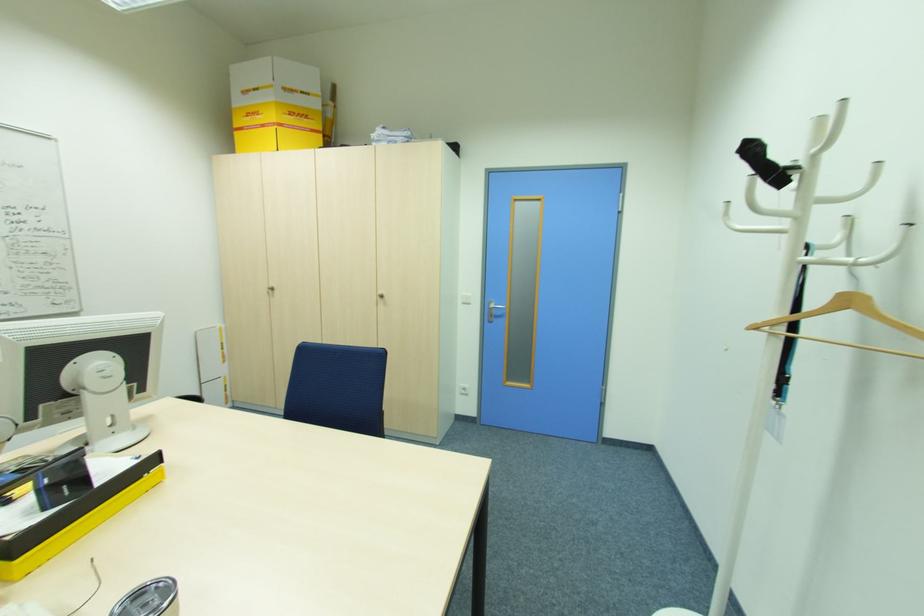
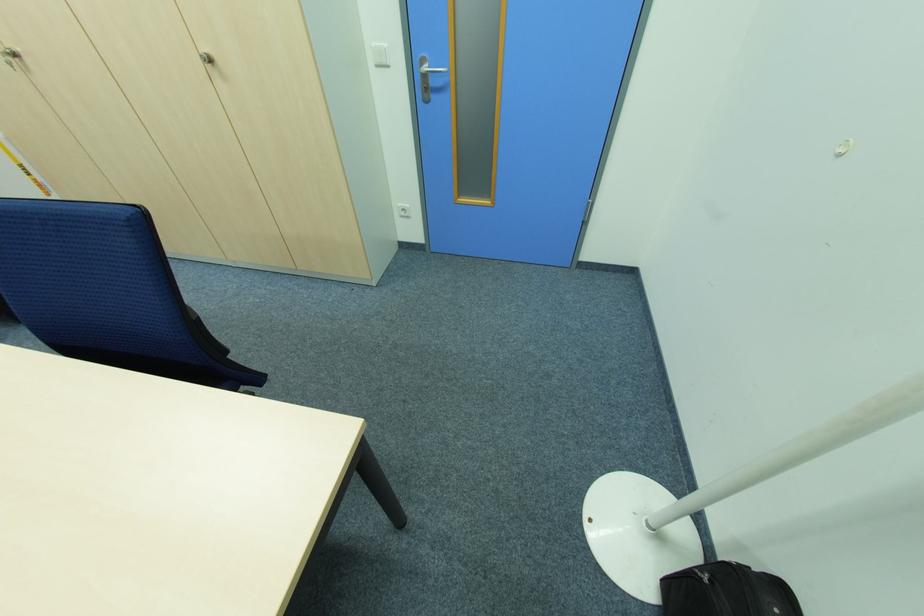
Locate, in the second image, the point that corresponds to (x=467, y=389) in the first image.

(407, 209)